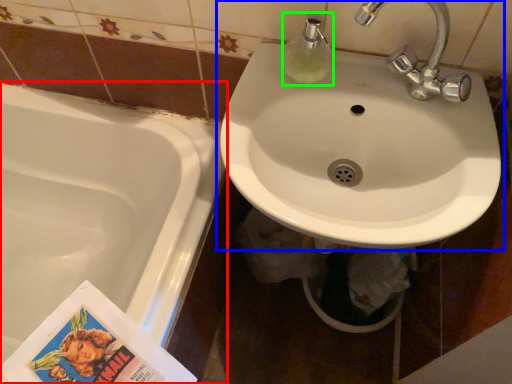
Question: Considering the real-world distances, which object is farthest from bathtub (highlighted by a red box)? sink (highlighted by a blue box) or soap dispenser (highlighted by a green box)?

Choices:
 (A) sink
 (B) soap dispenser

Answer: (B)